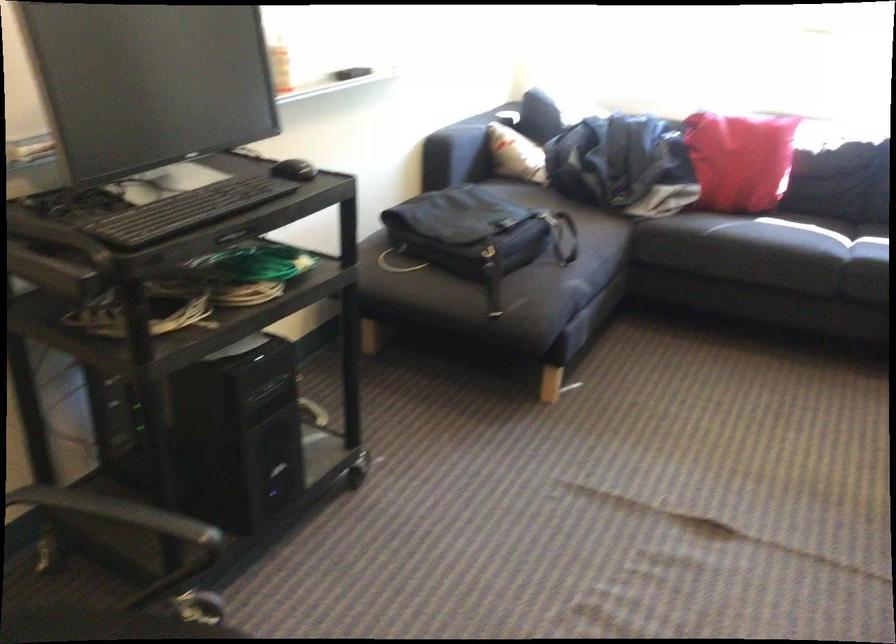
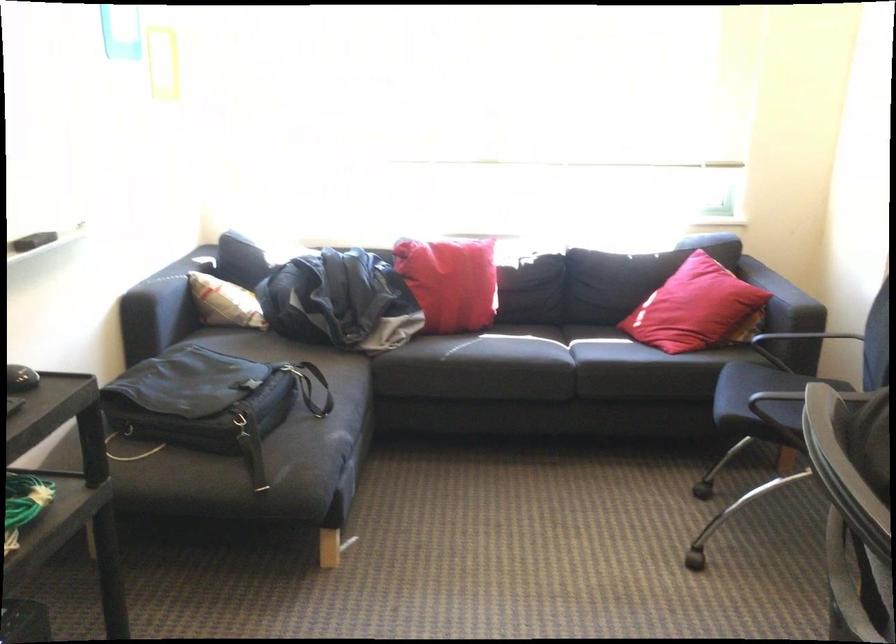
In the scene shown: What movement of the cameraman would produce the second image?

The cameraman moved toward left, forward.